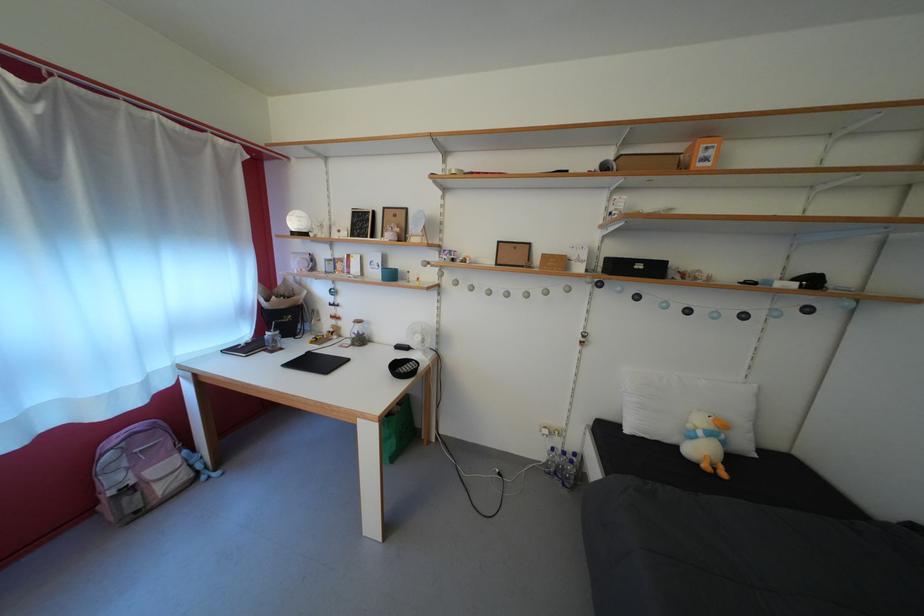
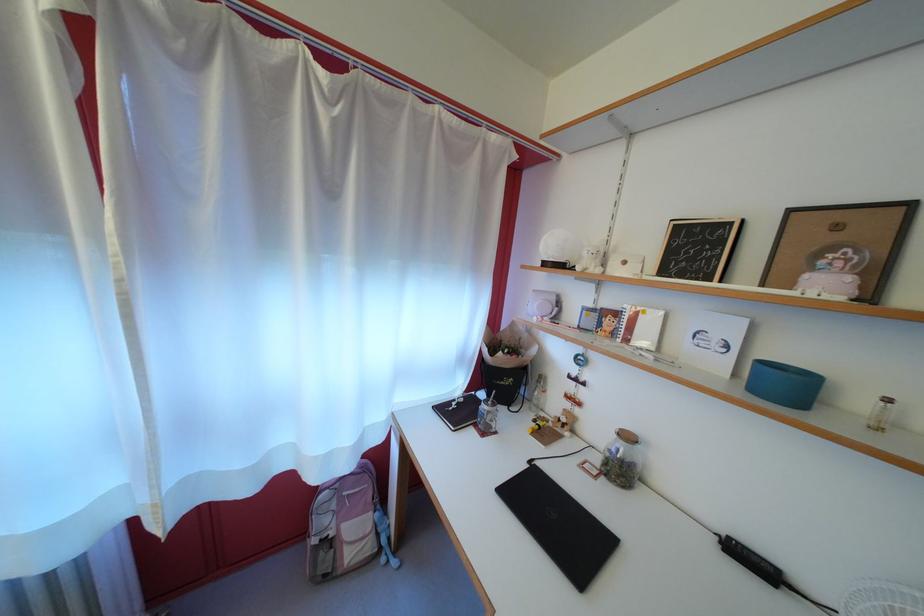
Where in the second image is the point corresponding to [274,357] from the first image?

(483, 431)